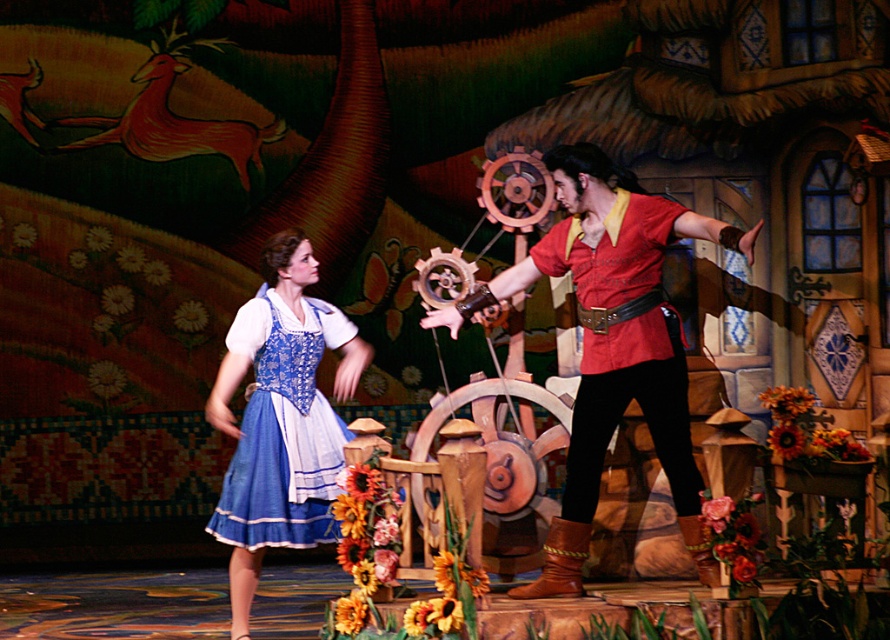
Based on the photo, does matte brown leather glove at center have a lesser height compared to blue satin dress at left?

Incorrect, matte brown leather glove at center's height does not fall short of blue satin dress at left's.

Can you confirm if matte brown leather glove at center is taller than blue satin dress at left?

Yes.

From the picture: Who is more forward, (637, 369) or (292, 381)?

Point (637, 369) is more forward.

The image size is (890, 640). I want to click on matte brown leather glove at center, so click(x=612, y=342).

Is matte brown leather glove at center positioned in front of matte red shirt at center?

That is True.

Is matte brown leather glove at center wider than matte red shirt at center?

Yes, matte brown leather glove at center is wider than matte red shirt at center.

Identify the location of matte brown leather glove at center. Image resolution: width=890 pixels, height=640 pixels. tap(612, 342).

Which is more to the left, matte red shirt at center or blue satin dress at left?

Positioned to the left is blue satin dress at left.

Does point (571, 419) come closer to viewer compared to point (252, 518)?

No.

Describe the element at coordinates (627, 403) in the screenshot. I see `matte red shirt at center` at that location.

You are a GUI agent. You are given a task and a screenshot of the screen. Output one action in this format:
    pyautogui.click(x=<x>, y=<y>)
    Task: Click on the matte red shirt at center
    
    Given the screenshot: What is the action you would take?
    click(x=627, y=403)